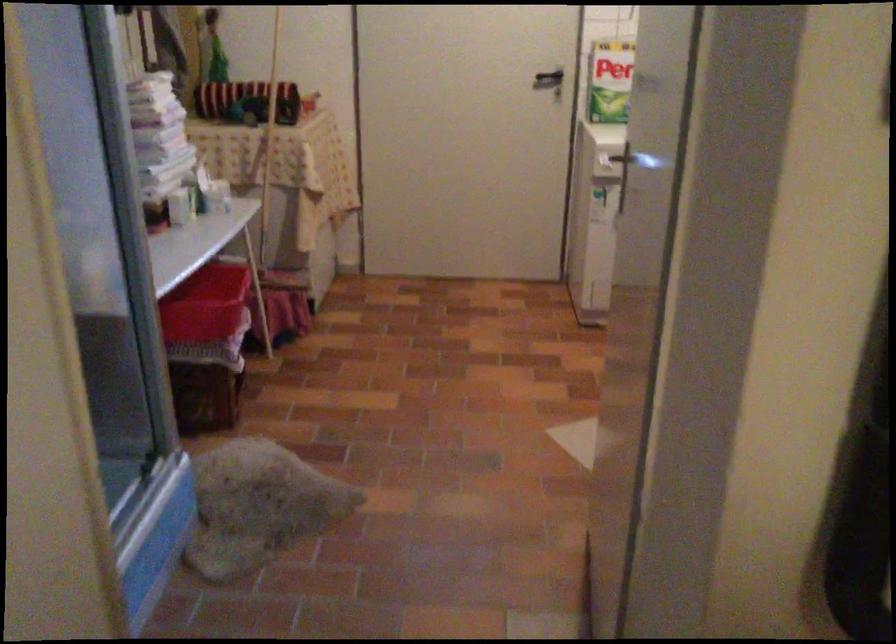
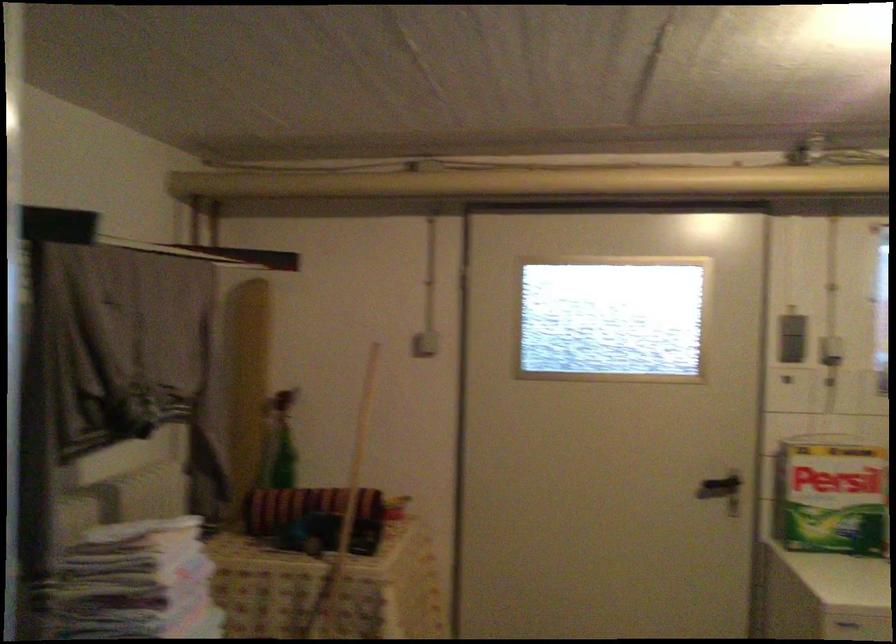
In the second image, find the point that corresponds to pixel 538 77 in the first image.

(720, 488)